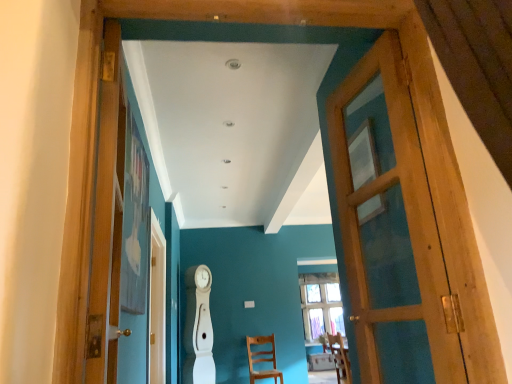
Question: Which direction should I rotate to look at wooden chair at center, the second chair from the front?

Choices:
 (A) right
 (B) left

Answer: (A)

Question: Could wooden chair at center, the 2th chair viewed from the top, be considered to be inside wooden door at left, the second door positioned from the right?

Choices:
 (A) no
 (B) yes

Answer: (A)

Question: Is wooden door at left, the second door positioned from the right, smaller than wooden chair at center, which is counted as the 1th chair, starting from the bottom?

Choices:
 (A) no
 (B) yes

Answer: (B)

Question: Is the depth of wooden door at left, the second door positioned from the right, less than that of wooden chair at center, the 1th chair in the left-to-right sequence?

Choices:
 (A) yes
 (B) no

Answer: (A)

Question: Would you say wooden door at left, the second door positioned from the right, is outside wooden chair at center, the second chair from the front?

Choices:
 (A) yes
 (B) no

Answer: (A)

Question: From the image's perspective, is wooden door at left, marked as the 1th door in a left-to-right arrangement, over wooden chair at center, which is counted as the 1th chair, starting from the bottom?

Choices:
 (A) no
 (B) yes

Answer: (B)

Question: Does wooden door at left, marked as the 1th door in a left-to-right arrangement, turn towards wooden chair at center, the 2th chair viewed from the top?

Choices:
 (A) no
 (B) yes

Answer: (A)

Question: From the image's perspective, is wooden chair at center, which is counted as the 1th chair, starting from the bottom, beneath wooden door at left, marked as the 1th door in a left-to-right arrangement?

Choices:
 (A) yes
 (B) no

Answer: (A)

Question: Is wooden chair at center, the 2th chair viewed from the top, positioned far away from wooden door at left, marked as the 1th door in a left-to-right arrangement?

Choices:
 (A) yes
 (B) no

Answer: (A)

Question: Is wooden chair at center, the 1th chair in the left-to-right sequence, taller than wooden door at left, marked as the 1th door in a left-to-right arrangement?

Choices:
 (A) no
 (B) yes

Answer: (A)

Question: Is wooden chair at center, the 2th chair viewed from the top, aimed at wooden door at left, marked as the 1th door in a left-to-right arrangement?

Choices:
 (A) no
 (B) yes

Answer: (B)

Question: Is wooden chair at center, which is the second chair in right-to-left order, in contact with wooden door at left, marked as the 1th door in a left-to-right arrangement?

Choices:
 (A) no
 (B) yes

Answer: (A)

Question: Can you confirm if wooden chair at center, the 2th chair viewed from the top, is thinner than wooden door at left, marked as the 1th door in a left-to-right arrangement?

Choices:
 (A) no
 (B) yes

Answer: (A)

Question: Is wooden door at right, which is counted as the first door, starting from the right, positioned with its back to wooden chair at center, which appears as the first chair when viewed from the front?

Choices:
 (A) no
 (B) yes

Answer: (A)